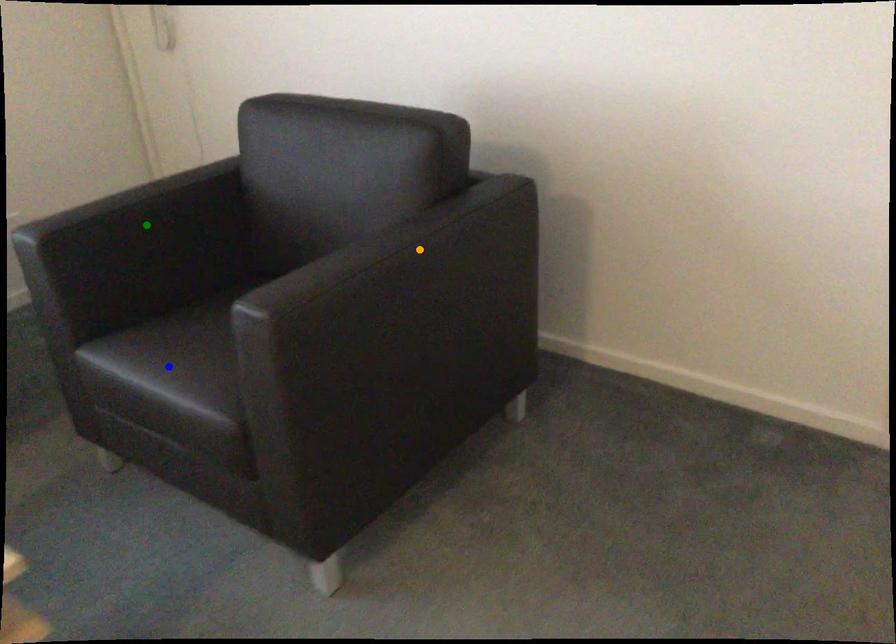
Order these from nearest to farthest:
- green point
- orange point
- blue point

orange point
green point
blue point